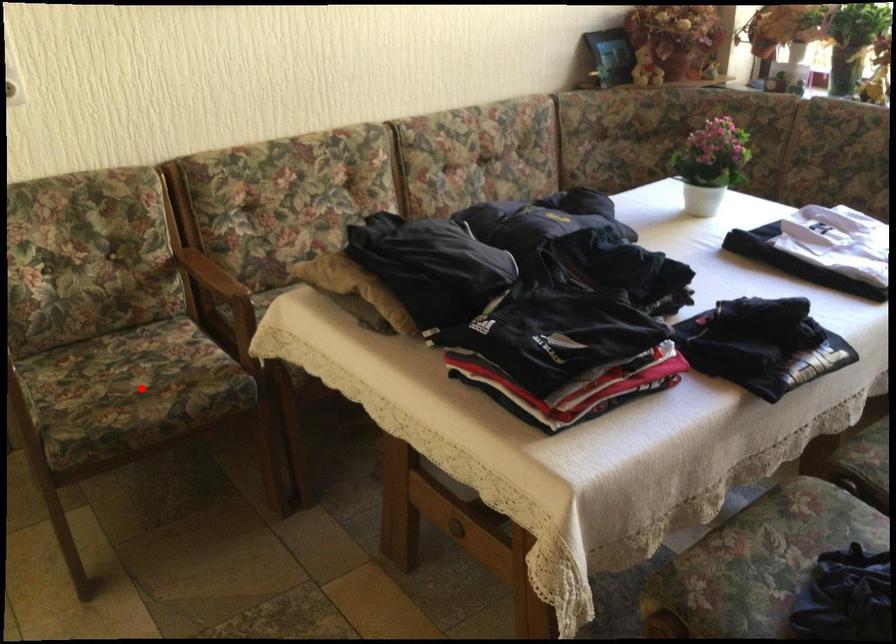
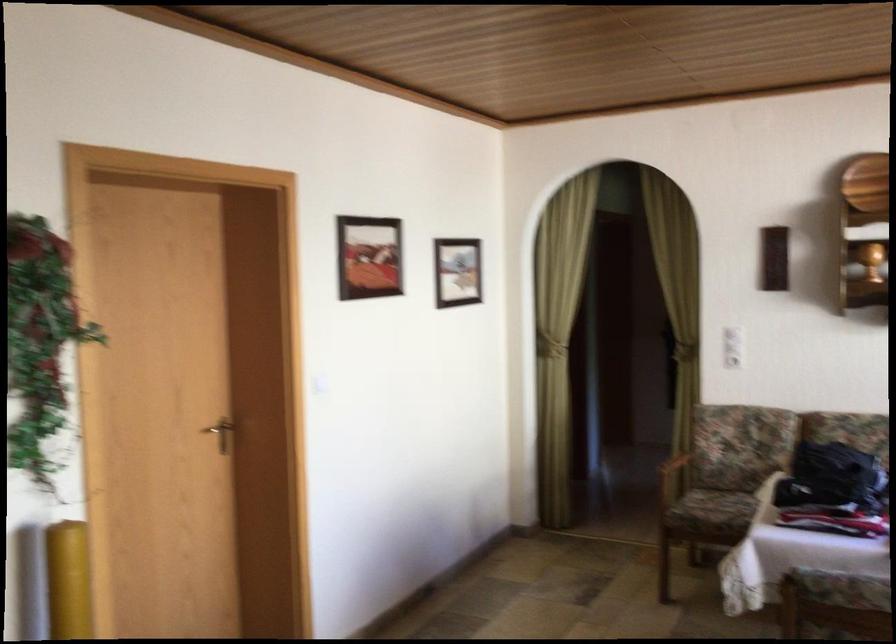
Question: I am providing you with two images of the same scene from different viewpoints. In image1, a red point is highlighted. Considering the same 3D point in image2, which of the following is correct?

Choices:
 (A) It is closer
 (B) It is farther

Answer: (B)